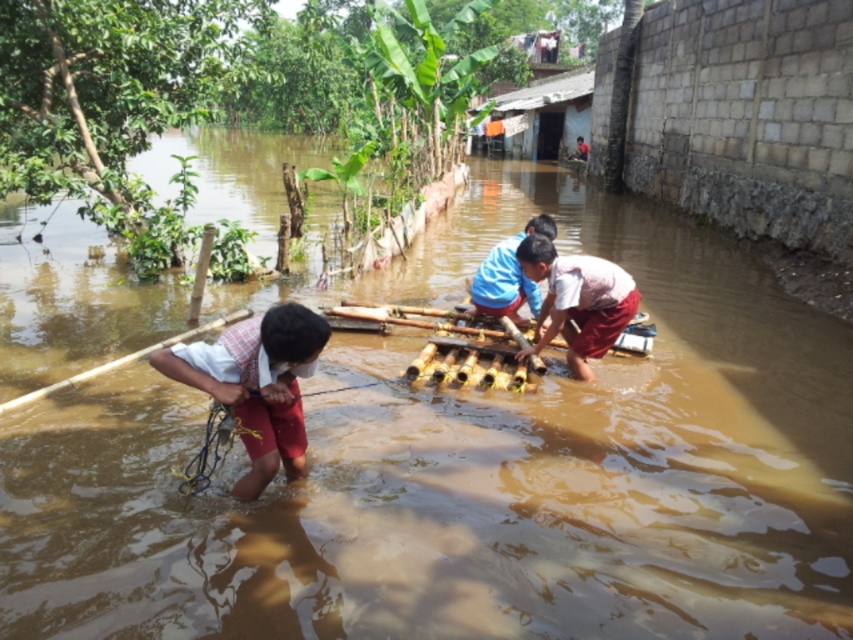
Question: Which point appears closest to the camera in this image?

Choices:
 (A) (548, 298)
 (B) (247, 324)

Answer: (B)

Question: Which point is closer to the camera taking this photo?

Choices:
 (A) (560, 312)
 (B) (302, 328)

Answer: (B)

Question: Among these objects, which one is farthest from the camera?

Choices:
 (A) pink fabric at center
 (B) white cotton shirt at lower left

Answer: (A)

Question: Where is white cotton shirt at lower left located in relation to pink fabric at center in the image?

Choices:
 (A) above
 (B) below

Answer: (B)

Question: Does white cotton shirt at lower left appear under pink fabric at center?

Choices:
 (A) no
 (B) yes

Answer: (B)

Question: Does white cotton shirt at lower left come in front of pink fabric at center?

Choices:
 (A) no
 (B) yes

Answer: (B)